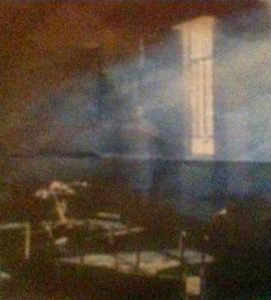
I want to click on column, so click(x=202, y=117).